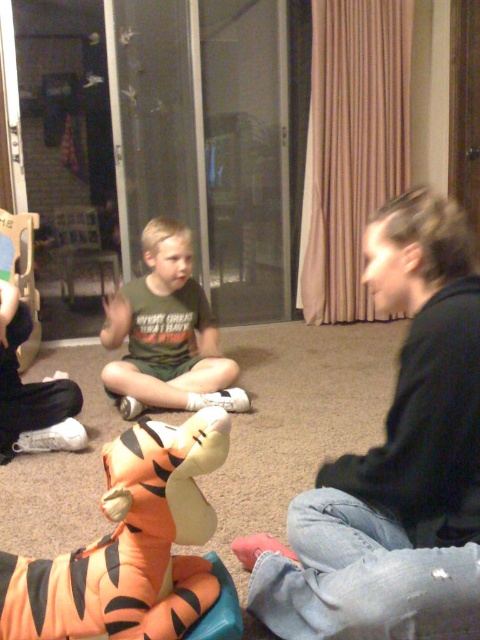
Question: Can you confirm if black cotton shirt at upper right is smaller than orange plush tiger at lower left?

Choices:
 (A) yes
 (B) no

Answer: (B)

Question: Which object is positioned farthest from the orange plush tiger at lower left?

Choices:
 (A) black cotton shirt at upper right
 (B) green matte shirt at center

Answer: (B)

Question: Can you confirm if orange plush tiger at lower left is positioned to the left of green matte shirt at center?

Choices:
 (A) no
 (B) yes

Answer: (A)

Question: From the image, what is the correct spatial relationship of orange plush tiger at lower left in relation to green matte shirt at center?

Choices:
 (A) above
 (B) below

Answer: (B)

Question: Which is farther from the green matte shirt at center?

Choices:
 (A) black cotton shirt at upper right
 (B) orange plush tiger at lower left

Answer: (B)

Question: Which object appears closest to the camera in this image?

Choices:
 (A) orange plush tiger at lower left
 (B) green matte shirt at center

Answer: (A)